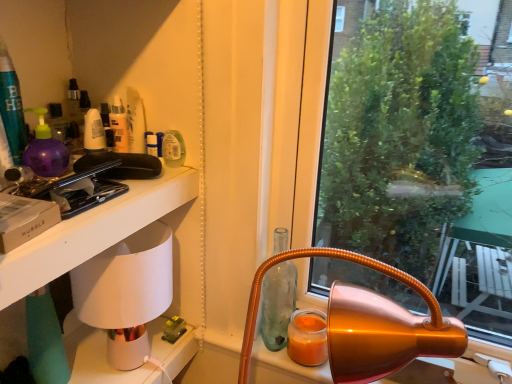
Question: Is point (132, 253) closer or farther from the camera than point (11, 251)?

Choices:
 (A) closer
 (B) farther

Answer: (B)

Question: From a real-world perspective, is white ceramic lamp at left positioned above or below white matte table at left?

Choices:
 (A) above
 (B) below

Answer: (B)

Question: Estimate the real-world distances between objects in this image. Which object is closer to the orange matte candle at lower right?

Choices:
 (A) transparent glass bottle at center
 (B) white ceramic lamp at left
 (C) white matte table at left

Answer: (A)

Question: Estimate the real-world distances between objects in this image. Which object is closer to the white ceramic lamp at left?

Choices:
 (A) orange matte candle at lower right
 (B) white matte table at left
 (C) transparent glass bottle at center

Answer: (B)